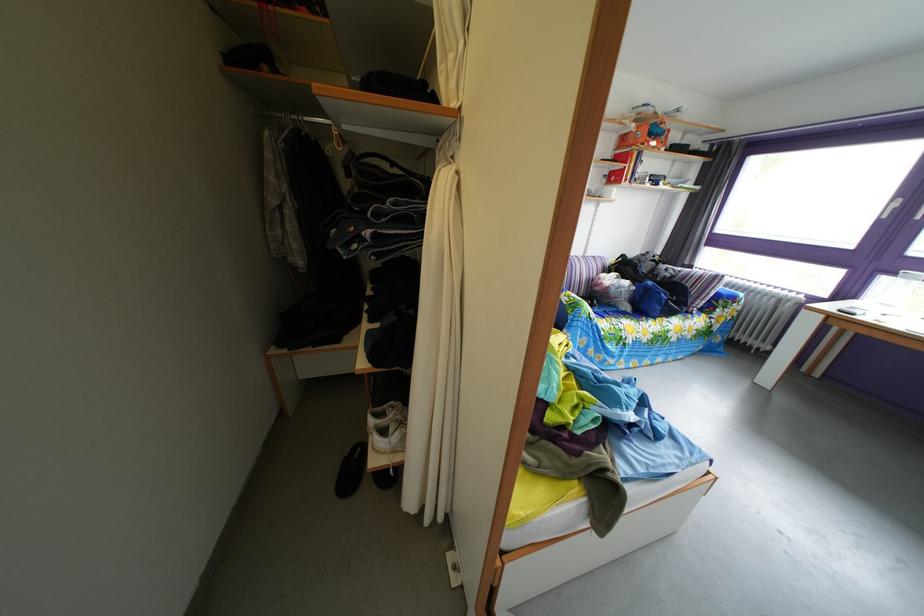
Where would you rest the striped sofa armrest? Please return your answer as a coordinate pair (x, y).

(582, 273)